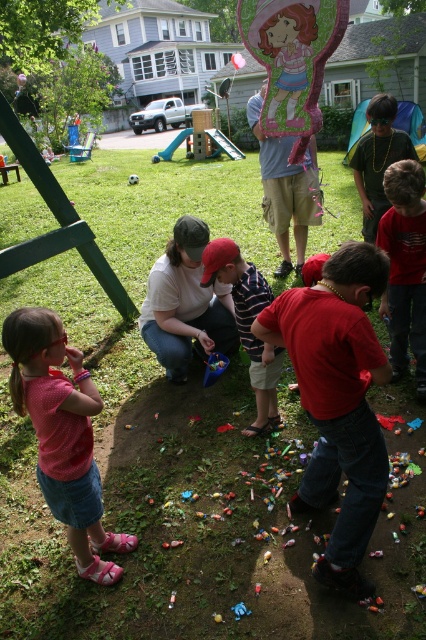
From the picture: You are at a backyard party where a pinata just broke open. You see a matte red shirt at center and a matte gray shirt at center. Which one is lower in position?

The matte red shirt at center is below the matte gray shirt at center, so the matte red shirt at center is lower in position.

You are standing at the center of the image and want to find the pink fabric dress at lower left. Which direction should you look to locate it?

The pink fabric dress at lower left is located at the lower left direction from your current position at the center of the image.

You are a parent at the party and want to give a gift to the child wearing the pink fabric dress at lower left and the matte red shirt at center. Since you have only one gift, you decide to give it to the child who is closer to you. Which child should you give the gift to?

The pink fabric dress at lower left is smaller than the matte red shirt at center, so the child wearing the pink fabric dress at lower left is closer to you. Therefore, you should give the gift to the child wearing the pink fabric dress at lower left.